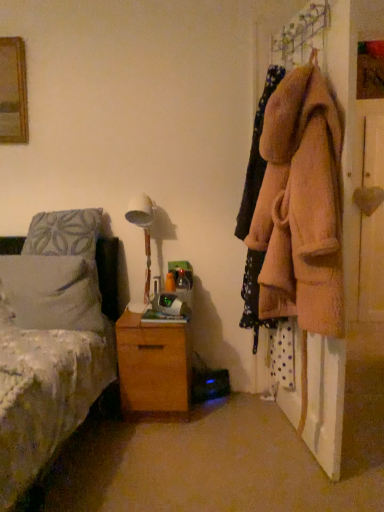
Question: Would you say white soft pillow at left is a long distance from wooden chest of drawers at lower center?

Choices:
 (A) no
 (B) yes

Answer: (A)

Question: Is the depth of white soft pillow at left greater than that of wooden chest of drawers at lower center?

Choices:
 (A) no
 (B) yes

Answer: (A)

Question: From the image's perspective, is white soft pillow at left below wooden chest of drawers at lower center?

Choices:
 (A) no
 (B) yes

Answer: (A)

Question: Considering the relative sizes of white soft pillow at left and wooden chest of drawers at lower center in the image provided, is white soft pillow at left taller than wooden chest of drawers at lower center?

Choices:
 (A) yes
 (B) no

Answer: (B)

Question: From a real-world perspective, is white soft pillow at left on wooden chest of drawers at lower center?

Choices:
 (A) no
 (B) yes

Answer: (B)

Question: From a real-world perspective, is fuzzy beige coat at right positioned above or below white soft pillow at left?

Choices:
 (A) below
 (B) above

Answer: (B)

Question: Considering the relative positions of fuzzy beige coat at right and white soft pillow at left in the image provided, is fuzzy beige coat at right to the left or to the right of white soft pillow at left?

Choices:
 (A) left
 (B) right

Answer: (B)

Question: From their relative heights in the image, would you say fuzzy beige coat at right is taller or shorter than white soft pillow at left?

Choices:
 (A) tall
 (B) short

Answer: (A)

Question: From the image's perspective, is fuzzy beige coat at right positioned above or below white soft pillow at left?

Choices:
 (A) above
 (B) below

Answer: (A)

Question: Considering the relative positions of wooden chest of drawers at lower center and fuzzy beige coat at right in the image provided, is wooden chest of drawers at lower center to the left or to the right of fuzzy beige coat at right?

Choices:
 (A) right
 (B) left

Answer: (B)

Question: From the image's perspective, is wooden chest of drawers at lower center above or below fuzzy beige coat at right?

Choices:
 (A) above
 (B) below

Answer: (B)

Question: In terms of width, does wooden chest of drawers at lower center look wider or thinner when compared to fuzzy beige coat at right?

Choices:
 (A) thin
 (B) wide

Answer: (B)

Question: Which is correct: wooden chest of drawers at lower center is inside fuzzy beige coat at right, or outside of it?

Choices:
 (A) outside
 (B) inside

Answer: (A)

Question: Considering the positions of fuzzy pink coat at right and fuzzy beige coat at right in the image, is fuzzy pink coat at right bigger or smaller than fuzzy beige coat at right?

Choices:
 (A) small
 (B) big

Answer: (B)

Question: Is fuzzy pink coat at right inside the boundaries of fuzzy beige coat at right, or outside?

Choices:
 (A) outside
 (B) inside

Answer: (A)